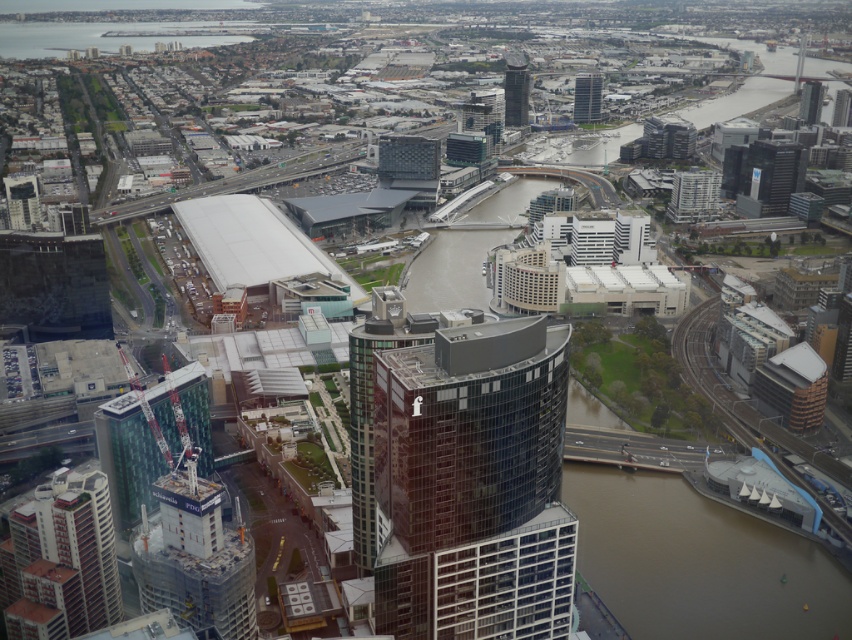
Between concrete construction crane at lower left and glassy reflective skyscraper at upper center, which one has more height?

concrete construction crane at lower left is taller.

Can you confirm if concrete construction crane at lower left is shorter than glassy reflective skyscraper at upper center?

Incorrect, concrete construction crane at lower left's height does not fall short of glassy reflective skyscraper at upper center's.

Which is behind, point (216, 573) or point (522, 88)?

Point (522, 88)

Find the location of `concrete construction crane at lower left`. concrete construction crane at lower left is located at coordinates (196, 560).

Which is behind, point (200, 488) or point (596, 96)?

Point (596, 96)

Is point (182, 522) less distant than point (577, 81)?

Yes, it is in front of point (577, 81).

This screenshot has height=640, width=852. I want to click on concrete construction crane at lower left, so click(196, 560).

Where is `black glass skyscraper at upper right`? The width and height of the screenshot is (852, 640). black glass skyscraper at upper right is located at coordinates (770, 177).

Does point (781, 182) come behind point (505, 68)?

Yes, it is.

Locate an element on the screen. Image resolution: width=852 pixels, height=640 pixels. black glass skyscraper at upper right is located at coordinates (770, 177).

Find the location of a particular element. The width and height of the screenshot is (852, 640). black glass skyscraper at upper right is located at coordinates (770, 177).